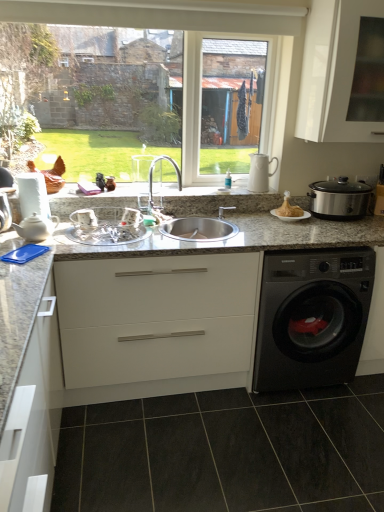
Question: Is silver metallic faucet at center bigger than white matte cabinet at lower left, which is the first cabinetry from left to right?

Choices:
 (A) yes
 (B) no

Answer: (B)

Question: From the image's perspective, is silver metallic faucet at center beneath white matte cabinet at lower left, placed as the third cabinetry when sorted from right to left?

Choices:
 (A) yes
 (B) no

Answer: (B)

Question: From the image's perspective, is silver metallic faucet at center on white matte cabinet at lower left, which is the first cabinetry from left to right?

Choices:
 (A) no
 (B) yes

Answer: (B)

Question: From a real-world perspective, is silver metallic faucet at center on top of white matte cabinet at lower left, placed as the third cabinetry when sorted from right to left?

Choices:
 (A) yes
 (B) no

Answer: (A)

Question: Is silver metallic faucet at center to the right of white matte cabinet at lower left, placed as the third cabinetry when sorted from right to left, from the viewer's perspective?

Choices:
 (A) no
 (B) yes

Answer: (B)

Question: Is silver metallic faucet at center spatially inside white glossy tea pot at left, or outside of it?

Choices:
 (A) inside
 (B) outside

Answer: (B)

Question: Is silver metallic faucet at center in front of or behind white glossy tea pot at left in the image?

Choices:
 (A) front
 (B) behind

Answer: (B)

Question: Based on their sizes in the image, would you say silver metallic faucet at center is bigger or smaller than white glossy tea pot at left?

Choices:
 (A) big
 (B) small

Answer: (A)

Question: Is point (150, 179) closer or farther from the camera than point (18, 233)?

Choices:
 (A) closer
 (B) farther

Answer: (B)

Question: Considering the positions of golden crispy turkey at center and white glossy tea pot at left in the image, is golden crispy turkey at center wider or thinner than white glossy tea pot at left?

Choices:
 (A) wide
 (B) thin

Answer: (A)

Question: Looking at the image, does golden crispy turkey at center seem bigger or smaller compared to white glossy tea pot at left?

Choices:
 (A) big
 (B) small

Answer: (A)

Question: Considering the positions of point (x=281, y=209) and point (x=54, y=218), is point (x=281, y=209) closer or farther from the camera than point (x=54, y=218)?

Choices:
 (A) farther
 (B) closer

Answer: (A)

Question: In terms of height, does golden crispy turkey at center look taller or shorter compared to white glossy tea pot at left?

Choices:
 (A) tall
 (B) short

Answer: (B)

Question: In the image, is silver metallic faucet at center on the left side or the right side of white ceramic pitcher at upper right, the 2th appliance from the right?

Choices:
 (A) right
 (B) left

Answer: (B)

Question: Considering the positions of silver metallic faucet at center and white ceramic pitcher at upper right, the 2th appliance from the right, in the image, is silver metallic faucet at center bigger or smaller than white ceramic pitcher at upper right, the 2th appliance from the right,?

Choices:
 (A) big
 (B) small

Answer: (A)